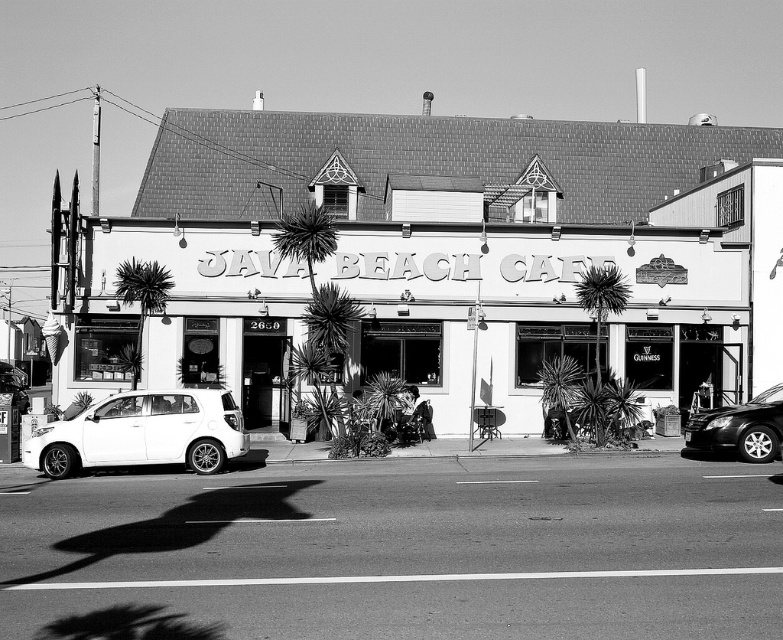
Does white matte building at center have a greater width compared to white matte hatchback at lower left?

Correct, the width of white matte building at center exceeds that of white matte hatchback at lower left.

Is white matte building at center to the right of white matte hatchback at lower left from the viewer's perspective?

Correct, you'll find white matte building at center to the right of white matte hatchback at lower left.

Which is behind, point (210, 308) or point (107, 422)?

The point (210, 308) is behind.

This screenshot has height=640, width=783. In order to click on white matte building at center in this screenshot , I will do `click(527, 307)`.

Find the location of a particular element. This screenshot has width=783, height=640. dark green leafy palm tree at left is located at coordinates (143, 292).

Is dark green leafy palm tree at left in front of dark green leafy palm tree at center?

That is True.

What are the coordinates of `dark green leafy palm tree at left` in the screenshot? It's located at (143, 292).

This screenshot has height=640, width=783. What are the coordinates of `dark green leafy palm tree at left` in the screenshot? It's located at (143, 292).

Where is `white matte building at center`? white matte building at center is located at coordinates (527, 307).

Who is lower down, white matte building at center or shiny black sedan at right?

shiny black sedan at right

The width and height of the screenshot is (783, 640). Identify the location of white matte building at center. (527, 307).